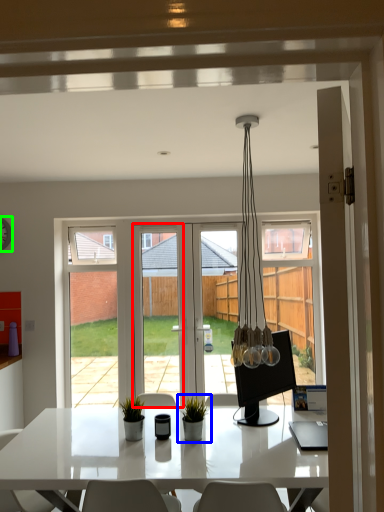
Question: Which object is the farthest from screen door (highlighted by a red box)? Choose among these: houseplant (highlighted by a blue box) or clock (highlighted by a green box).

Choices:
 (A) houseplant
 (B) clock

Answer: (A)